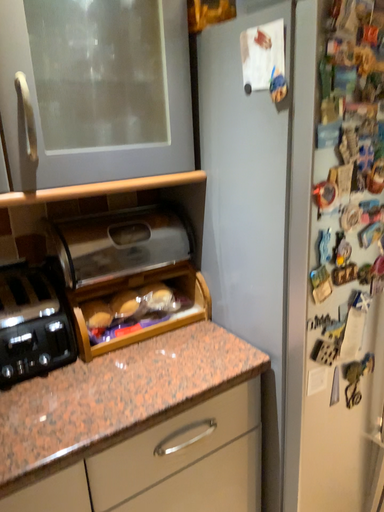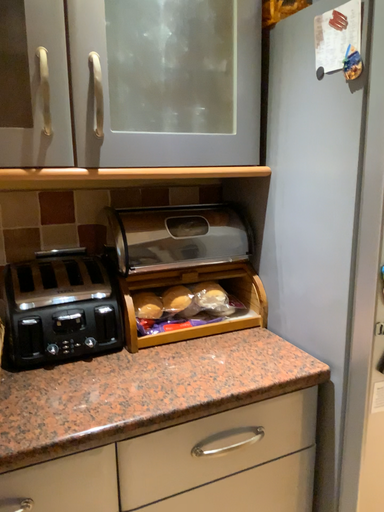
Question: How did the camera likely rotate when shooting the video?

Choices:
 (A) rotated right
 (B) rotated left

Answer: (B)